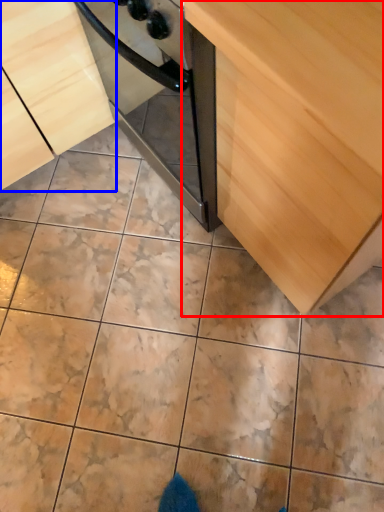
Question: Among these objects, which one is farthest to the camera, cabinetry (highlighted by a red box) or cabinetry (highlighted by a blue box)?

Choices:
 (A) cabinetry
 (B) cabinetry

Answer: (B)